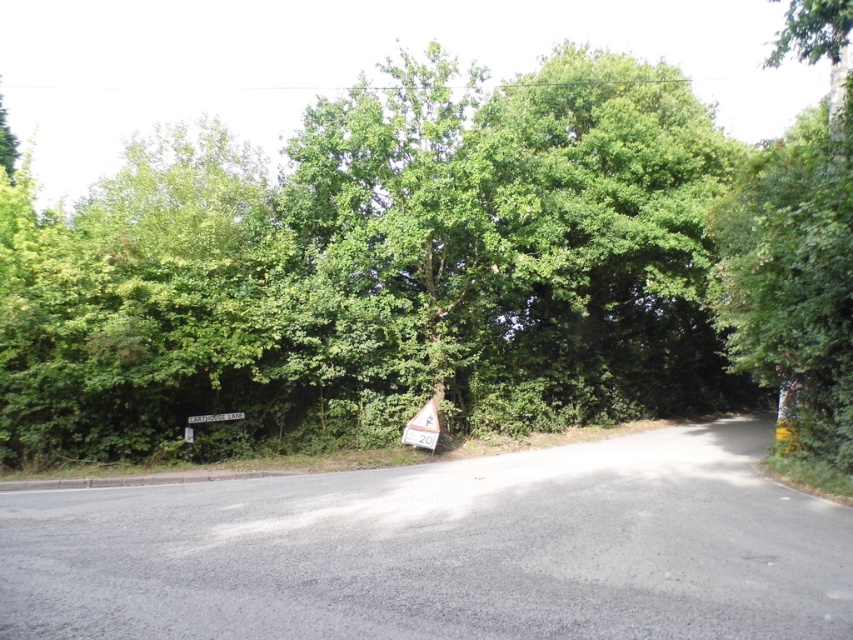
Question: Which of the following is the closest to the observer?

Choices:
 (A) white plastic sign at center
 (B) green leafy tree at center

Answer: (B)

Question: Is green leafy tree at center closer to the viewer compared to white plastic sign at center?

Choices:
 (A) yes
 (B) no

Answer: (A)

Question: Is green leafy tree at center further to the viewer compared to white plastic sign at center?

Choices:
 (A) yes
 (B) no

Answer: (B)

Question: Which object is closer to the camera taking this photo?

Choices:
 (A) green leafy tree at center
 (B) white plastic sign at center

Answer: (A)

Question: Does green leafy tree at center appear over white plastic sign at center?

Choices:
 (A) yes
 (B) no

Answer: (A)